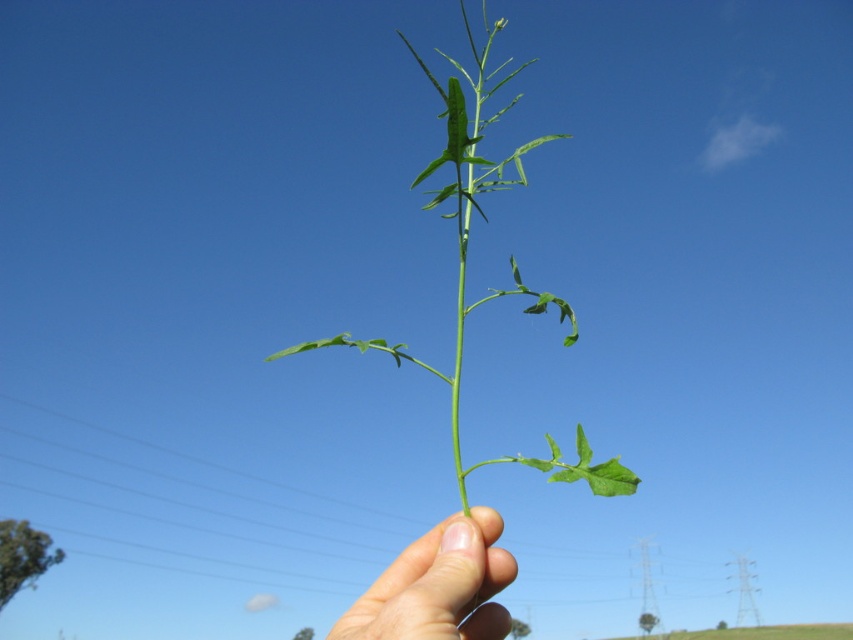
Question: Can you confirm if green leafy stem at center is positioned to the right of green matte leaf at center?

Choices:
 (A) yes
 (B) no

Answer: (B)

Question: From the image, what is the correct spatial relationship of green leafy stem at center in relation to green matte leaf at center?

Choices:
 (A) above
 (B) below

Answer: (B)

Question: Is skinny flesh at center below green matte leaf at center?

Choices:
 (A) no
 (B) yes

Answer: (B)

Question: Which object is positioned closest to the green matte leaf at center?

Choices:
 (A) green leafy stem at center
 (B) skinny flesh at center

Answer: (A)

Question: Among these objects, which one is nearest to the camera?

Choices:
 (A) green leafy stem at center
 (B) green matte leaf at center

Answer: (A)

Question: Among these points, which one is nearest to the camera?

Choices:
 (A) (550, 436)
 (B) (440, 627)

Answer: (B)